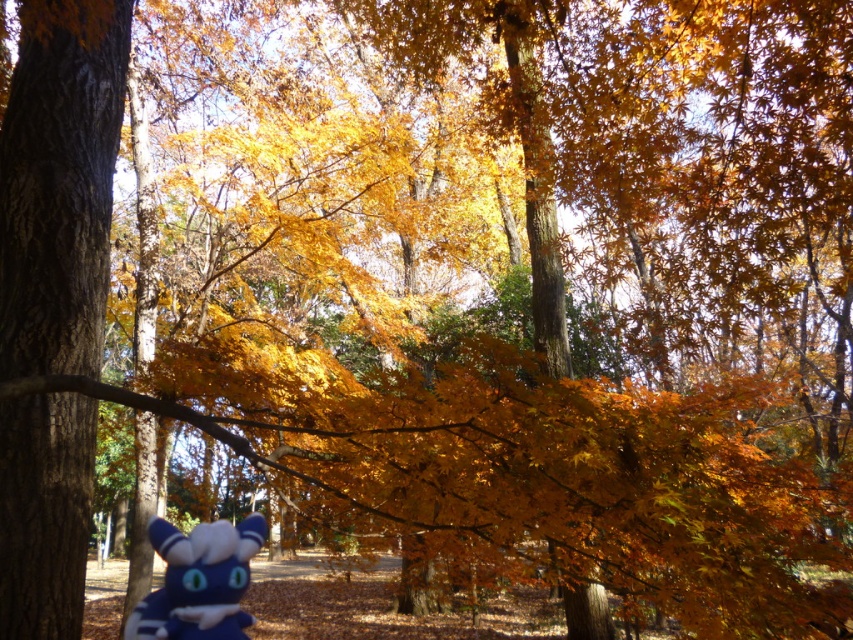
You are a small squirrel trying to cross from the brown rough bark tree at left to the blue plush toy at lower center. Which path is wider for you to pass through?

Result: The brown rough bark tree at left might be wider than blue plush toy at lower center, so the path between them is likely wide enough for the squirrel to pass through.